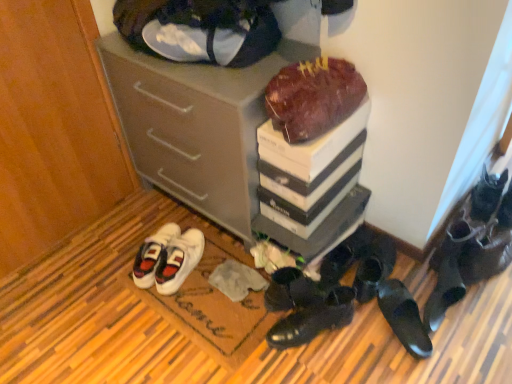
Find the location of `vacant region above white fabric doormat at lower center (from a real-world perspective)`. vacant region above white fabric doormat at lower center (from a real-world perspective) is located at coordinates (208, 297).